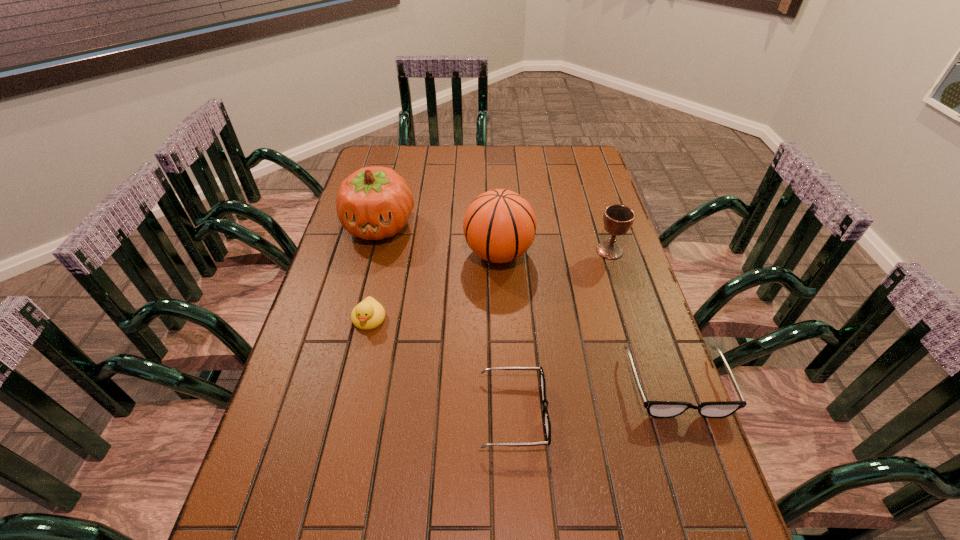
Locate an element on the screen. Image resolution: width=960 pixels, height=540 pixels. vacant region located 0.240m on the back of the basketball is located at coordinates (495, 190).

The image size is (960, 540). Find the location of `free spot located on the side of the pumpkin with the cute face`. free spot located on the side of the pumpkin with the cute face is located at coordinates (367, 277).

Locate an element on the screen. The height and width of the screenshot is (540, 960). vacant space located on the face of the duckling is located at coordinates (349, 403).

Identify the location of vacant space located on the left of the chalice. The image size is (960, 540). (522, 251).

You are a GUI agent. You are given a task and a screenshot of the screen. Output one action in this format:
    pyautogui.click(x=<x>, y=<y>)
    Task: Click on the pumpkin positioned at the left edge
    This screenshot has height=540, width=960.
    Given the screenshot: What is the action you would take?
    pyautogui.click(x=373, y=203)

You are a GUI agent. You are given a task and a screenshot of the screen. Output one action in this format:
    pyautogui.click(x=<x>, y=<y>)
    Task: Click on the duckling positioned at the left edge
    This screenshot has width=960, height=540.
    Given the screenshot: What is the action you would take?
    pyautogui.click(x=369, y=314)

Where is `spectacles situated at the right edge`? spectacles situated at the right edge is located at coordinates (659, 409).

Find the location of a particular element. The image size is (960, 540). chalice that is positioned at the right edge is located at coordinates (618, 219).

In the image, there is a desktop. Identify the location of vacant space at the far edge. (451, 159).

Image resolution: width=960 pixels, height=540 pixels. In order to click on free region at the left edge of the desktop in this screenshot , I will do `click(344, 290)`.